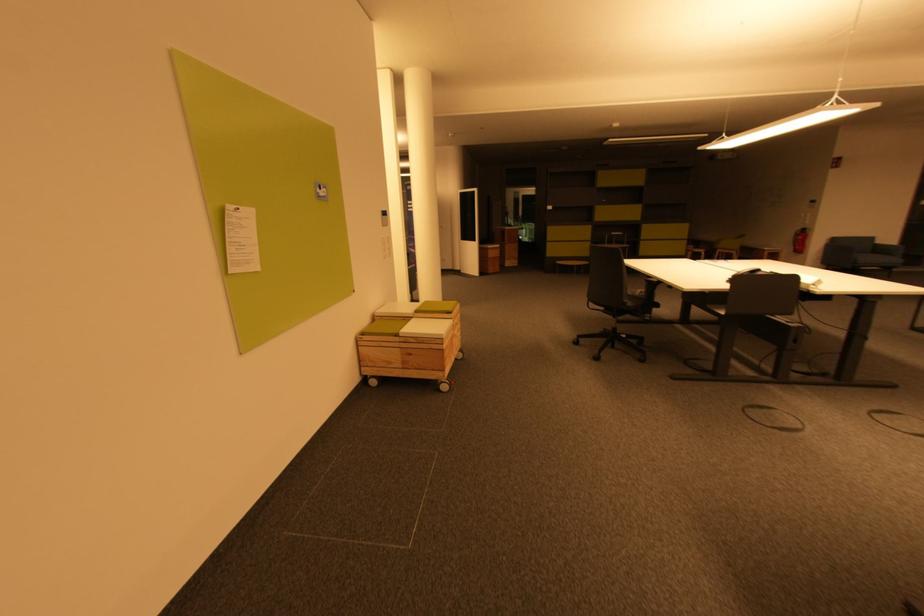
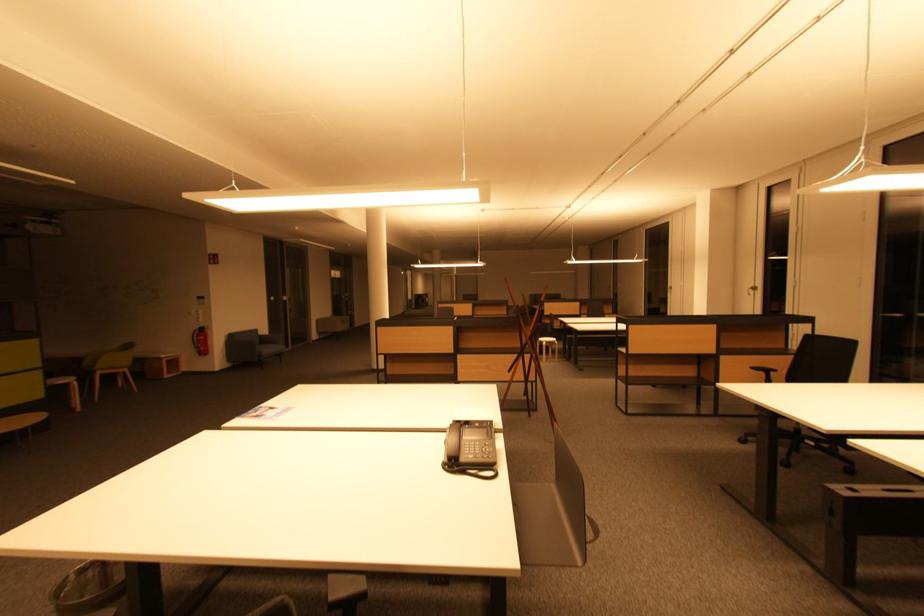
Find the pixel in the second image that matches point 721,252 in the first image.

(98, 374)